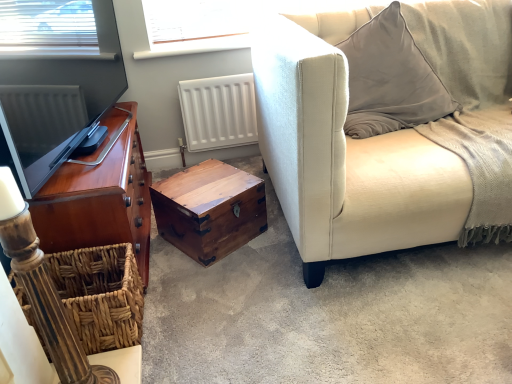
Locate an element on the screen. vacant region to the right of woven brown basket at lower left is located at coordinates (180, 326).